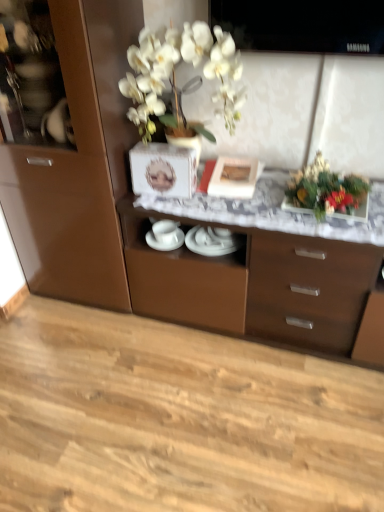
Question: From the image's perspective, relative to natural wood floor at lower center, is matte white picture frame at center above or below?

Choices:
 (A) above
 (B) below

Answer: (A)

Question: Is matte white picture frame at center wider or thinner than natural wood floor at lower center?

Choices:
 (A) thin
 (B) wide

Answer: (A)

Question: Which is farther from the white glossy plates at center, the 2th tableware from the right?

Choices:
 (A) natural wood floor at lower center
 (B) shiny metallic vase at upper right
 (C) matte white picture frame at center
 (D) white glossy plates at center, which appears as the 1th tableware when viewed from the right
 (E) brown glossy cabinet at center

Answer: (A)

Question: Based on their relative distances, which object is nearer to the brown glossy cabinet at center?

Choices:
 (A) matte white picture frame at center
 (B) white glossy plates at center, positioned as the second tableware in left-to-right order
 (C) white glossy plates at center, acting as the 1th tableware starting from the left
 (D) shiny metallic vase at upper right
 (E) natural wood floor at lower center

Answer: (B)